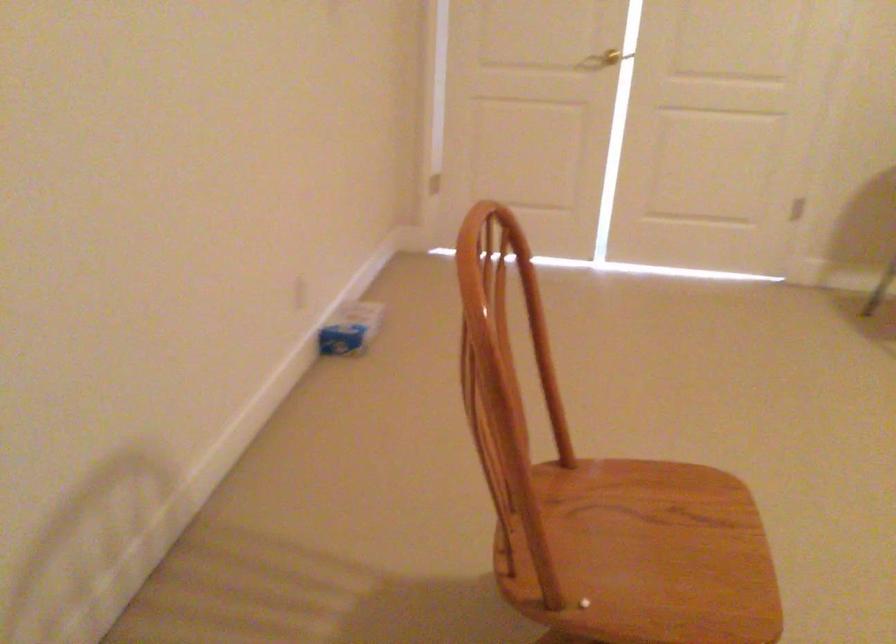
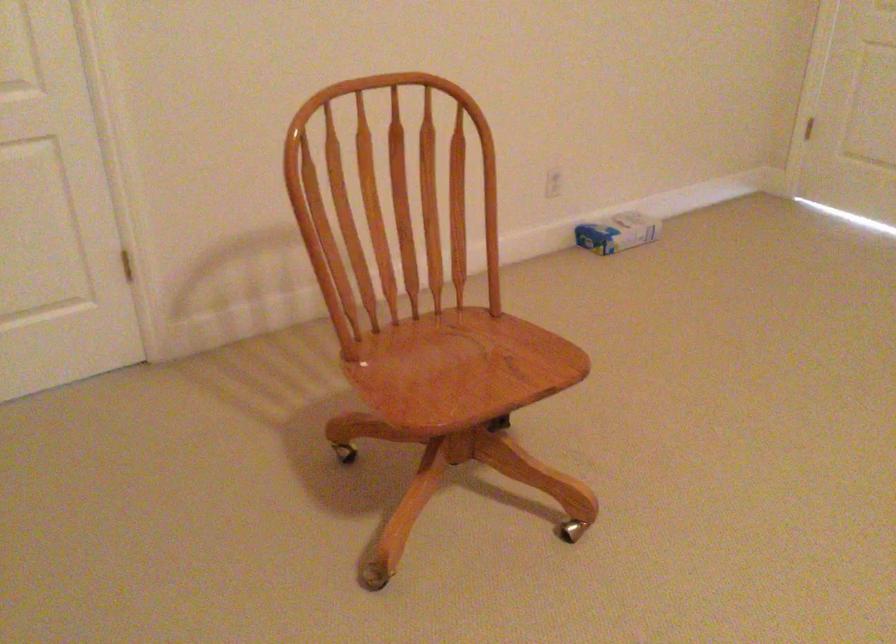
Locate, in the second image, the point that corresponds to [632,567] in the first image.

(428, 374)